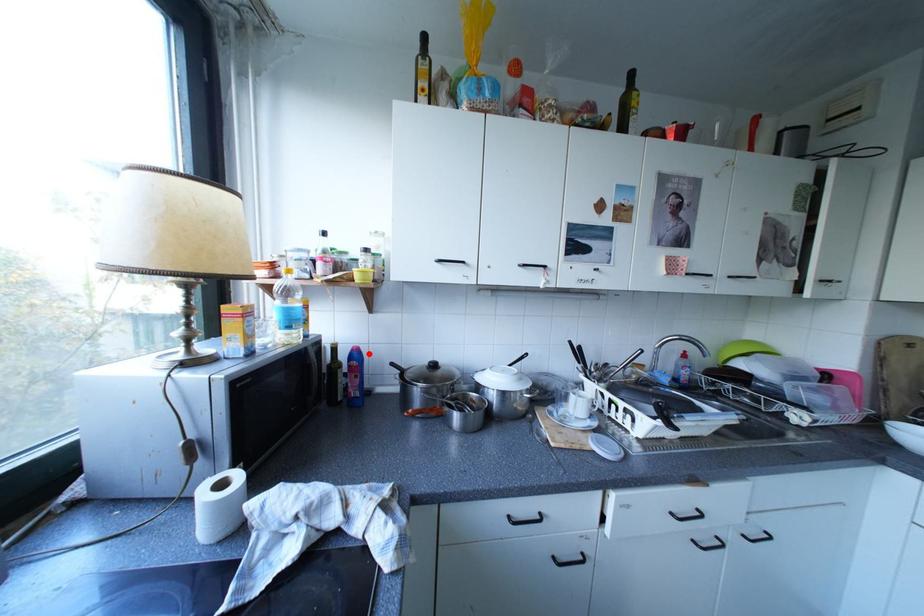
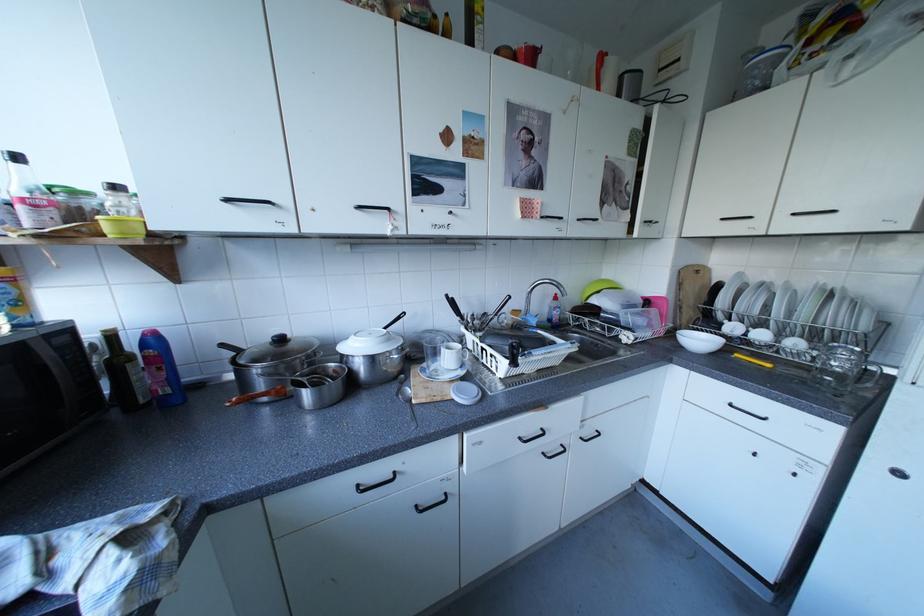
Find the pixel in the second image that matches the highlighted location in the first image.

(165, 339)